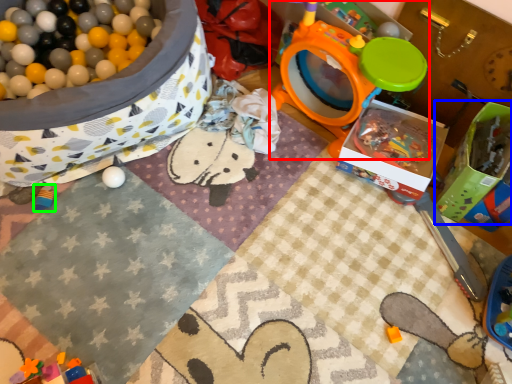
Question: Which is farther away from toy (highlighted by a red box)? box (highlighted by a blue box) or toy (highlighted by a green box)?

Choices:
 (A) box
 (B) toy

Answer: (B)